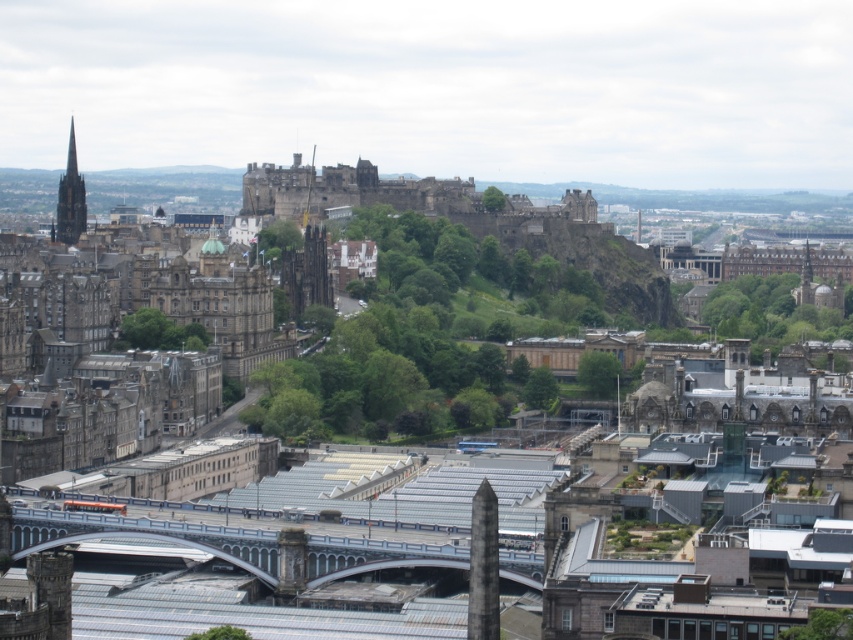
Question: Can you confirm if matte stone spire at left is thinner than dark gray stone spire at center?

Choices:
 (A) no
 (B) yes

Answer: (A)

Question: Does metallic gray bridge at center appear on the left side of matte stone spire at left?

Choices:
 (A) yes
 (B) no

Answer: (B)

Question: Based on their relative distances, which object is farther from the dark gray stone spire at center?

Choices:
 (A) metallic gray bridge at center
 (B) matte stone spire at left

Answer: (A)

Question: Is metallic gray bridge at center thinner than dark gray stone spire at center?

Choices:
 (A) yes
 (B) no

Answer: (B)

Question: Which object is closer to the camera taking this photo?

Choices:
 (A) dark gray stone spire at center
 (B) metallic gray bridge at center

Answer: (B)

Question: Based on their relative distances, which object is farther from the matte stone spire at left?

Choices:
 (A) dark gray stone spire at center
 (B) metallic gray bridge at center

Answer: (B)